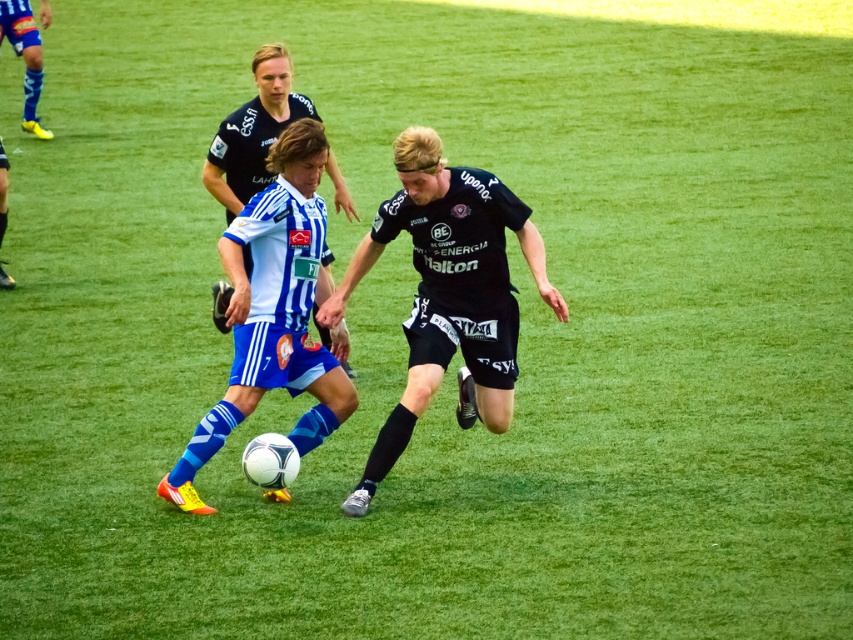
Question: Which object is positioned farthest from the blue matte soccer ball at center?

Choices:
 (A) white jersey at center
 (B) black matte soccer ball at center
 (C) white matte soccer ball at center

Answer: (A)

Question: Does black matte soccer ball at center appear under white jersey at center?

Choices:
 (A) no
 (B) yes

Answer: (B)

Question: Which object is the closest to the white jersey at center?

Choices:
 (A) blue matte soccer ball at center
 (B) black matte soccer ball at center

Answer: (A)

Question: Can you confirm if blue matte soccer ball at center is positioned below white jersey at center?

Choices:
 (A) no
 (B) yes

Answer: (B)

Question: Does blue matte soccer ball at center have a larger size compared to white jersey at center?

Choices:
 (A) yes
 (B) no

Answer: (A)

Question: Which is farther from the blue matte soccer ball at center?

Choices:
 (A) white matte soccer ball at center
 (B) white jersey at center
 (C) black matte soccer ball at center

Answer: (B)